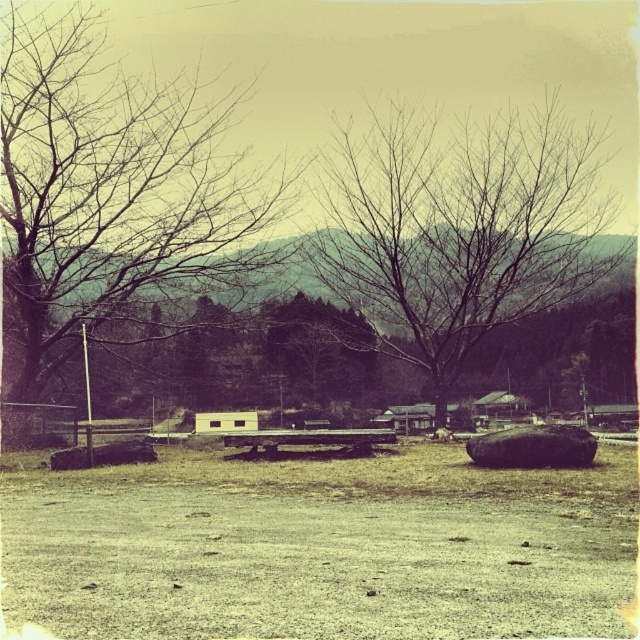
You are standing in the middle of the open area and want to walk to the shed. You notice two sets of bare branches in the scene. Which set of bare branches, the bare branches at left or the bare branches at center, is closer to your current position?

The bare branches at center is closer to your current position because you are standing in the middle of the open area, and the distance between the two sets of branches is 22.29 feet, so the one at center is nearer to you.

You are planning to set up a picnic table in this rural area. Based on the image, which object is taller, the bare branches at center or the wooden picnic table at center?

The bare branches at center are taller than the wooden picnic table at center according to the description.

You are standing in the rural landscape and want to place a small flag on the smooth brown rock at center. However, there are bare branches at center above it. Do you think the flag will be visible from below the rock?

The bare branches at center is located above smooth brown rock at center, so the flag placed on the smooth brown rock at center might be partially obscured by the branches above, making it less visible from below the rock.